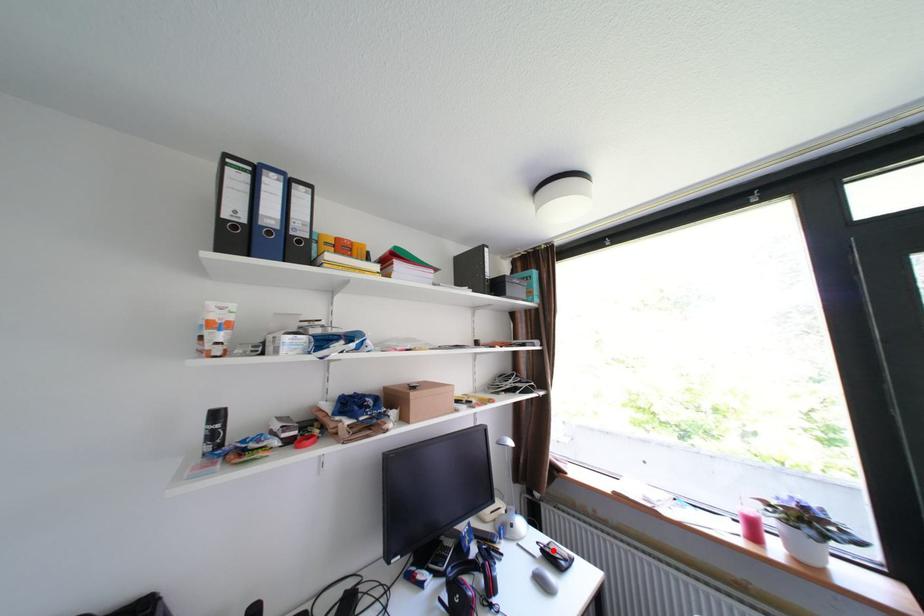
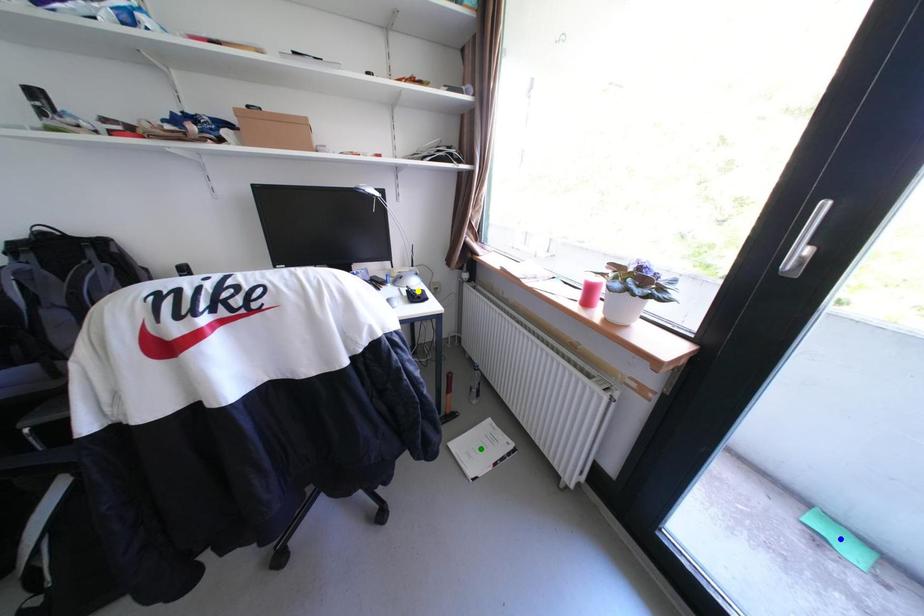
Question: I am providing you with two images of the same scene from different viewpoints. A red point is marked on the first image. You are given multiple points on the second image. Can you choose the point in image 2 that corresponds to the point in image 1?

Choices:
 (A) green point
 (B) yellow point
 (C) blue point

Answer: (B)